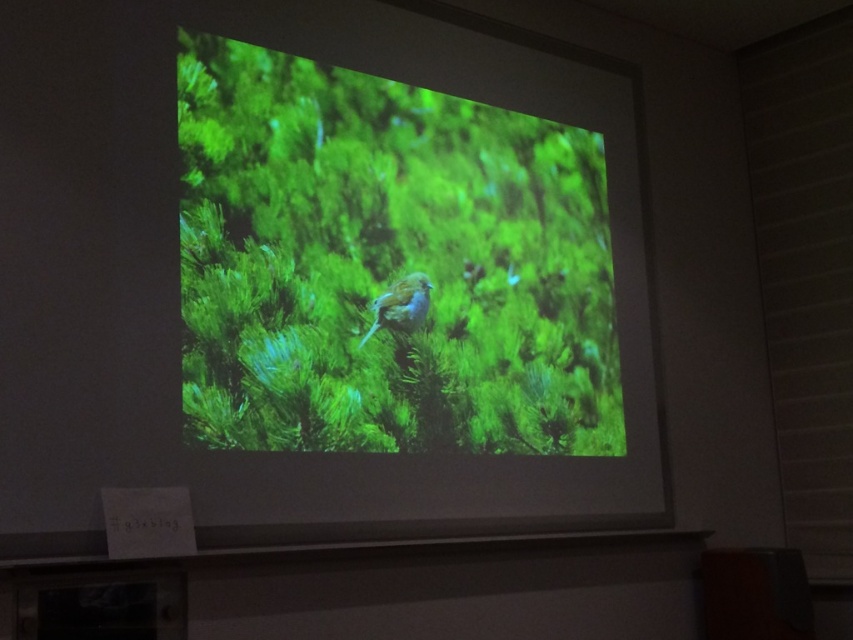
Image resolution: width=853 pixels, height=640 pixels. Describe the element at coordinates (386, 264) in the screenshot. I see `green leafy plant at center` at that location.

Does point (202, 333) lie in front of point (378, 321)?

Yes, it is.

The width and height of the screenshot is (853, 640). Find the location of `green leafy plant at center`. green leafy plant at center is located at coordinates (386, 264).